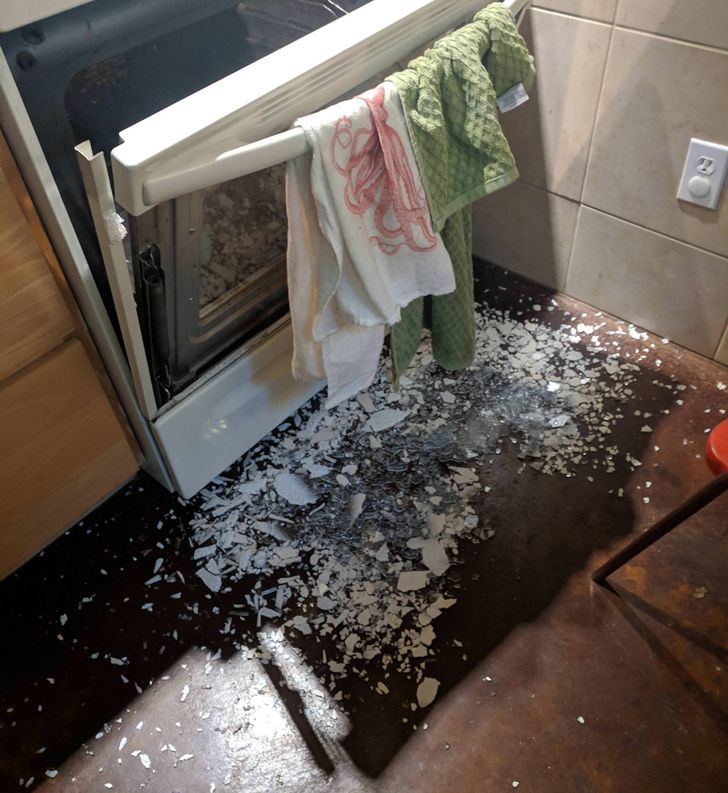
Locate instances of where i'd grab to open the oven in the image. Your answer should be formatted as a list of tuples, i.e. [(x1, y1), (x2, y2), ...], where each tuple contains the x and y coordinates of a point satisfying the conditions above.

[(261, 143), (296, 143), (362, 97), (461, 54), (241, 154)]